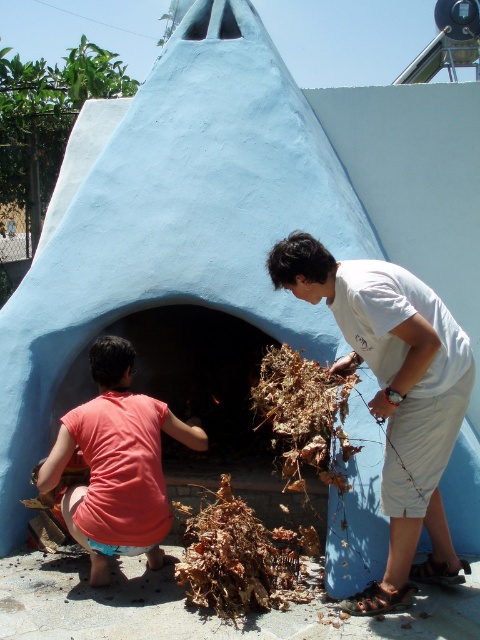
You are standing in front of the light blue conical structure and want to hand a tool to both the white cotton shirt at center and the pink fabric shirt at lower left. Which person should you approach first to ensure you can reach them without moving too far?

You should approach the white cotton shirt at center first since they are closer to you than the pink fabric shirt at lower left, making it easier to reach them without moving further away.

You are a photographer setting up a shot of the two shirts in the scene. You need to ensure that the white cotton shirt at center and the pink fabric shirt at lower left are both visible in the frame. Based on their sizes, which shirt should you position closer to the camera to maintain their visibility?

The white cotton shirt at center might be wider than the pink fabric shirt at lower left, so positioning the white cotton shirt at center closer to the camera would help ensure both shirts are visible in the frame.